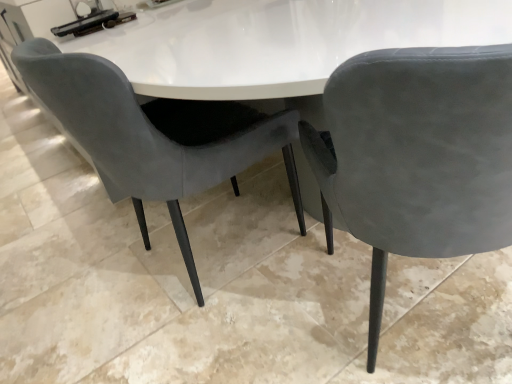
At what (x,y) coordinates should I click in order to perform the action: click on free space to the left of suede gray chair at center, acting as the 1th chair starting from the left. Please return your answer as a coordinate pair (x, y). The image size is (512, 384). Looking at the image, I should click on (72, 284).